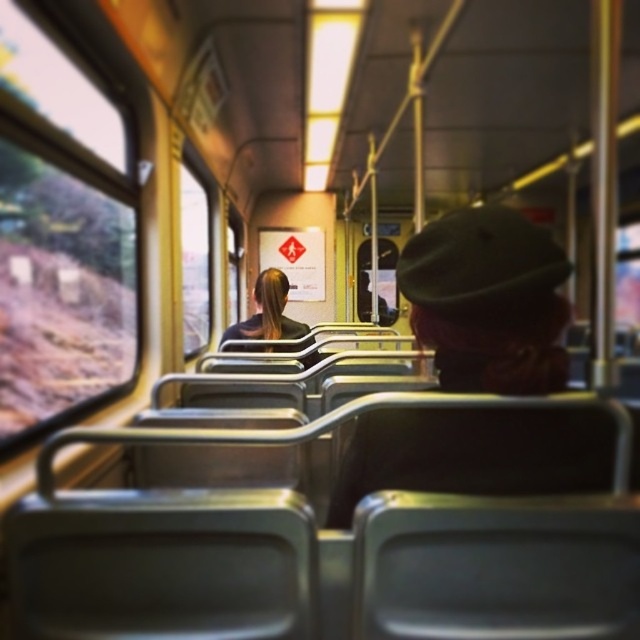
Is transparent glass window at center thinner than black fabric hair at center?

Indeed, transparent glass window at center has a lesser width compared to black fabric hair at center.

Is point (200, 243) in front of point (276, 307)?

That is False.

Where is `transparent glass window at center`? The image size is (640, 640). transparent glass window at center is located at coordinates (195, 262).